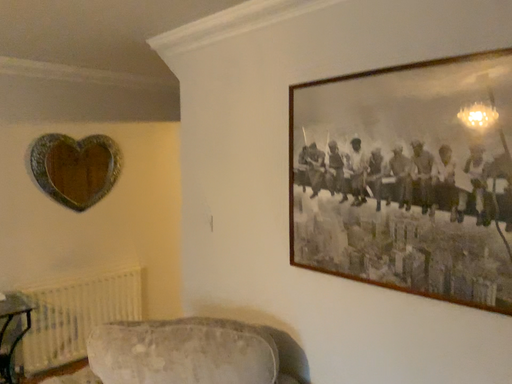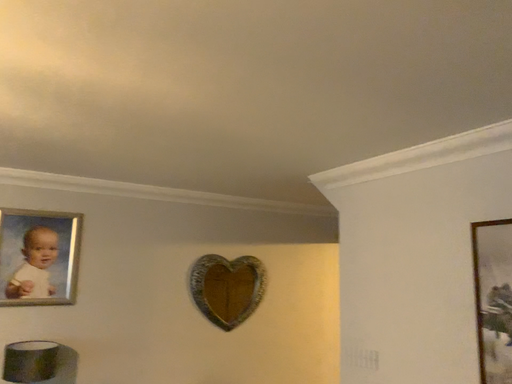
Question: Which way did the camera rotate in the video?

Choices:
 (A) rotated left
 (B) rotated right

Answer: (A)